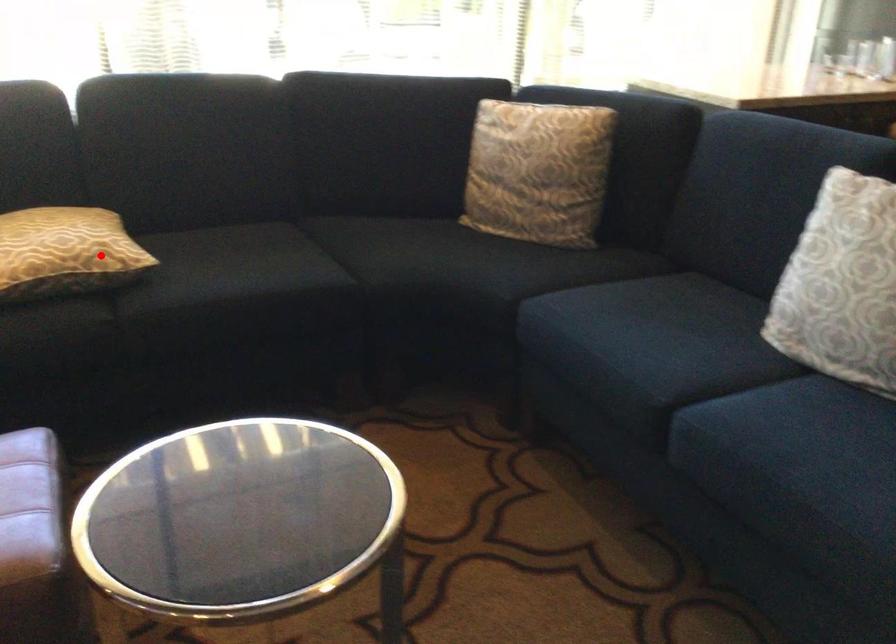
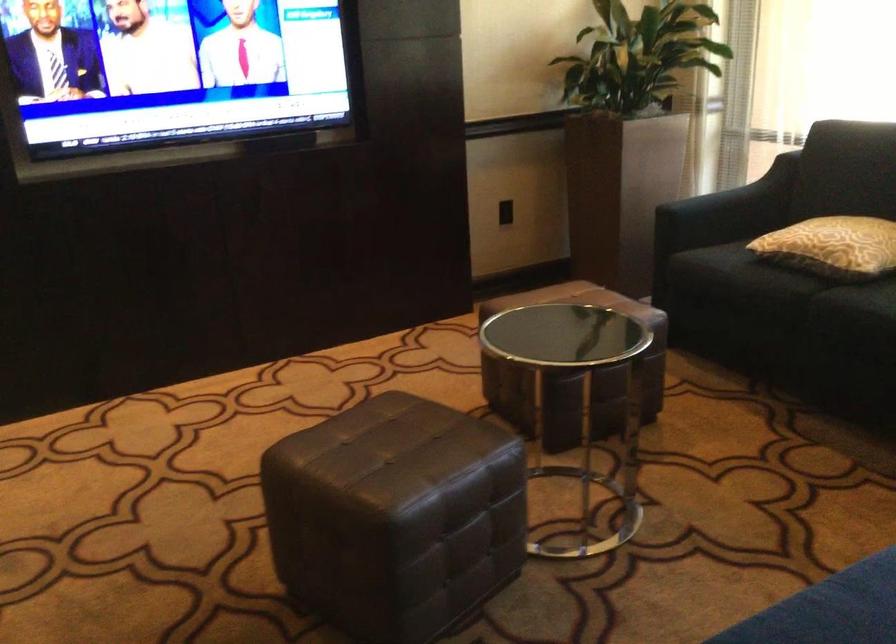
The point at the highlighted location is marked in the first image. Where is the corresponding point in the second image?

(832, 245)